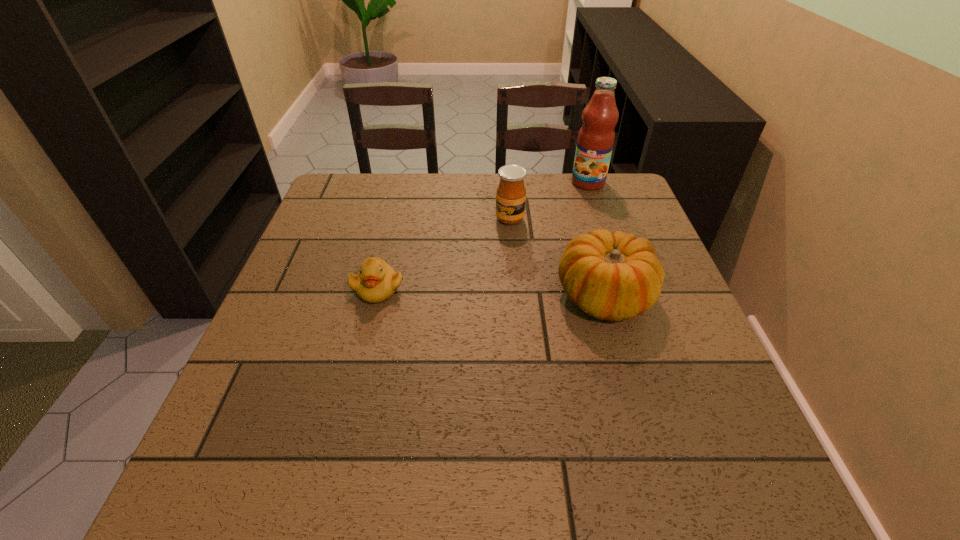
Image resolution: width=960 pixels, height=540 pixels. I want to click on free space that satisfies the following two spatial constraints: 1. on the back side of the tallest object; 2. on the right side of the gourd, so click(x=571, y=183).